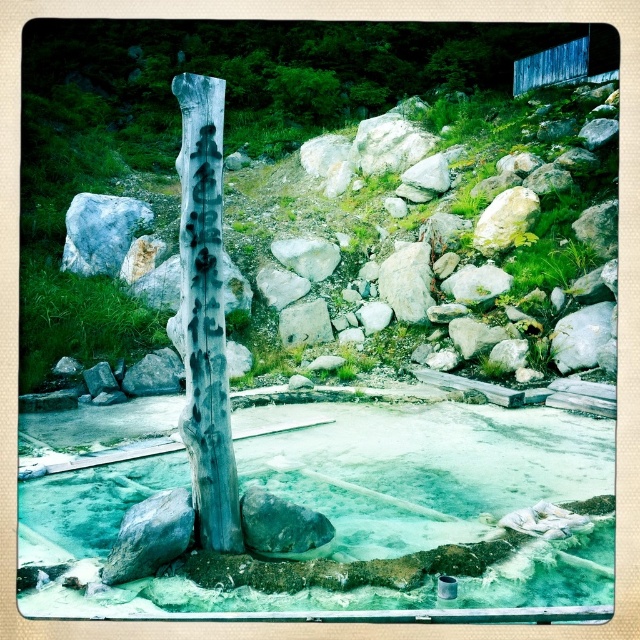
Question: Estimate the real-world distances between objects in this image. Which object is closer to the gray wood tree trunk at center?

Choices:
 (A) gray/rough rock at upper left
 (B) weathered wood signpost at center

Answer: (B)

Question: Which of these objects is positioned farthest from the gray wood tree trunk at center?

Choices:
 (A) white smooth rock at center
 (B) gray rock at center
 (C) greenish stone pool at center
 (D) white smooth rock at upper right

Answer: (A)

Question: Is gray wood tree trunk at center to the left of gray/rough rock at upper left from the viewer's perspective?

Choices:
 (A) yes
 (B) no

Answer: (B)

Question: Which object is positioned closest to the weathered wood signpost at center?

Choices:
 (A) gray wood tree trunk at center
 (B) gray rock at center

Answer: (B)

Question: Observing the image, what is the correct spatial positioning of gray/rough rock at upper left in reference to gray rock at center?

Choices:
 (A) above
 (B) below

Answer: (A)

Question: Is greenish stone pool at center thinner than gray/rough rock at upper left?

Choices:
 (A) yes
 (B) no

Answer: (B)